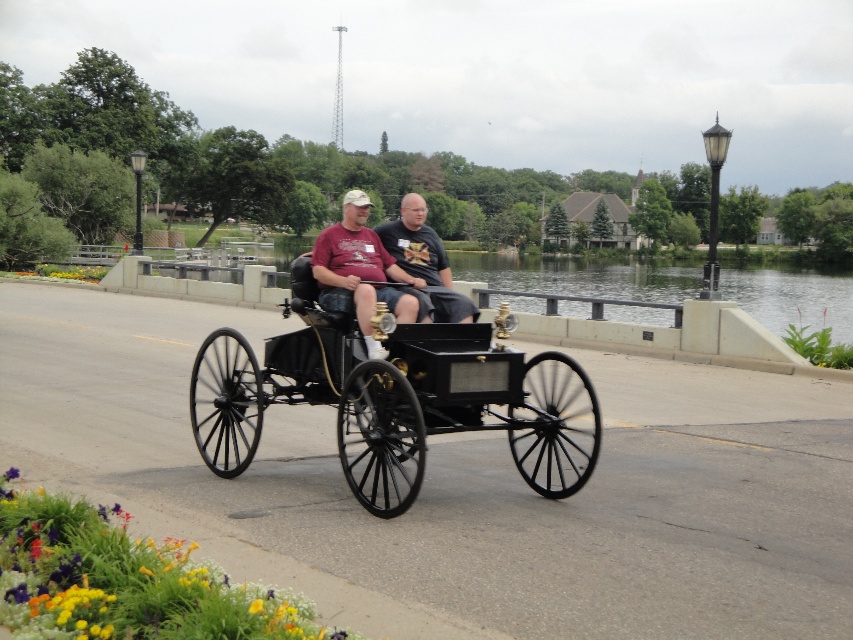
Question: Which object is farther from the camera taking this photo?

Choices:
 (A) matte black buggy at center
 (B) dark gray fabric shirt at center

Answer: (B)

Question: Is matte black buggy at center below dark gray fabric shirt at center?

Choices:
 (A) yes
 (B) no

Answer: (A)

Question: Is black polished wood horse cart at center smaller than matte black buggy at center?

Choices:
 (A) no
 (B) yes

Answer: (A)

Question: Which point is closer to the camera?

Choices:
 (A) black polished wood horse cart at center
 (B) matte black buggy at center
 (C) dark gray fabric shirt at center

Answer: (A)

Question: Which point is farther to the camera?

Choices:
 (A) (447, 282)
 (B) (424, 396)

Answer: (A)

Question: Does matte black buggy at center lie in front of dark gray fabric shirt at center?

Choices:
 (A) no
 (B) yes

Answer: (B)